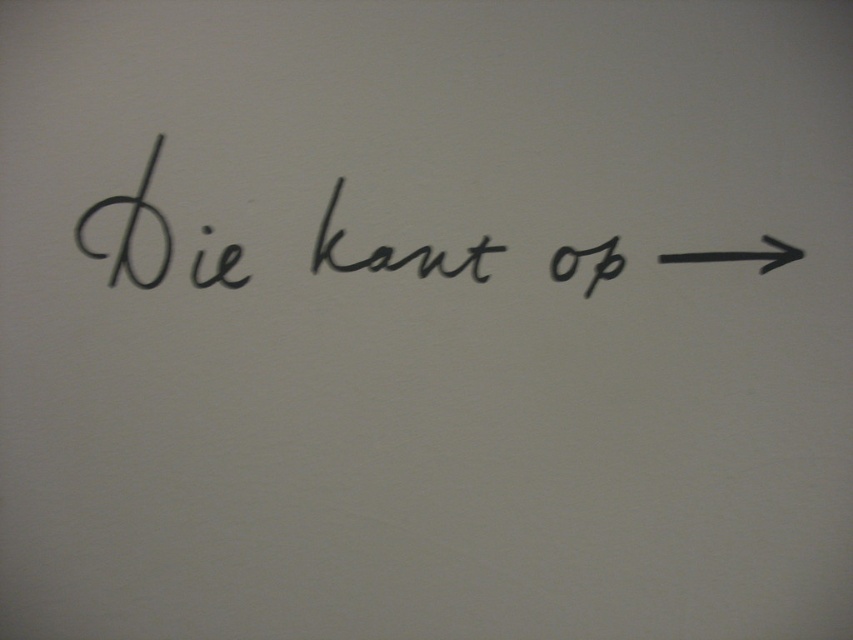
Does black handwritten text at center come behind black rubber arrow at right?

No, black handwritten text at center is closer to the viewer.

Who is shorter, black handwritten text at center or black rubber arrow at right?

With less height is black rubber arrow at right.

I want to click on black handwritten text at center, so click(392, 252).